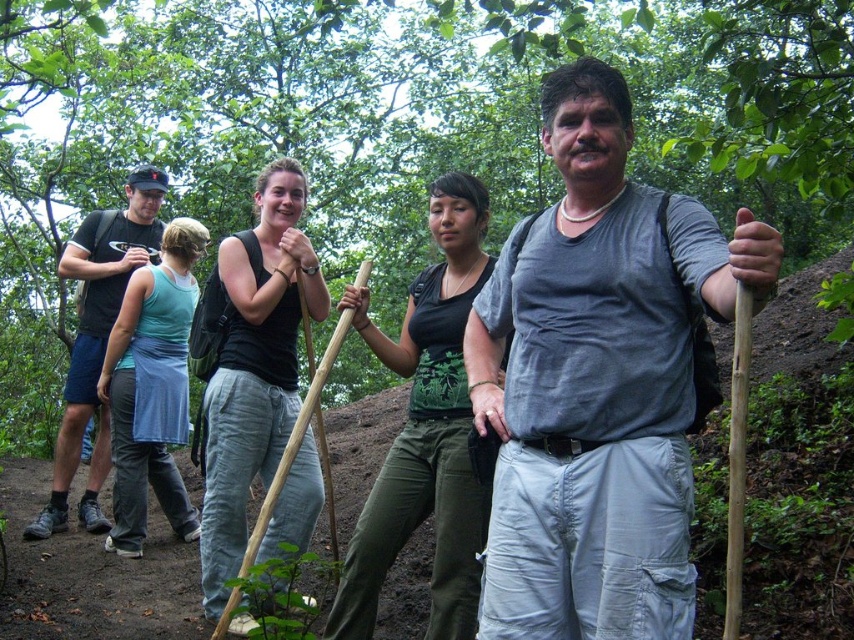
You are standing at the base of the green leafy tree at upper center and want to hand a tool to the person wearing the black cotton tank top at center. Can you reach them without moving from your current position?

The green leafy tree at upper center and the black cotton tank top at center are 7.27 meters apart, so you cannot reach them without moving from your current position.

You are standing at the origin point in the forest scene. Where is the gray matte tank top at center located in terms of coordinates?

The gray matte tank top at center is located at coordinates point (598, 381).